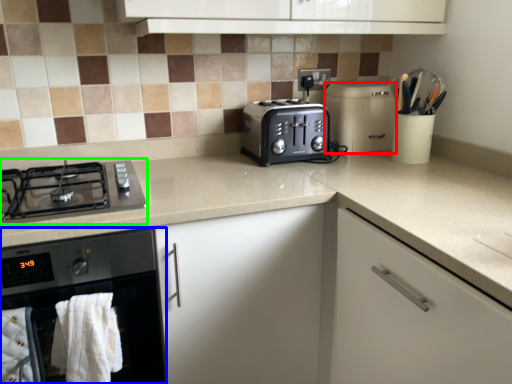
Question: Estimate the real-world distances between objects in this image. Which object is closer to kitchen appliance (highlighted by a red box), home appliance (highlighted by a blue box) or gas stove (highlighted by a green box)?

Choices:
 (A) home appliance
 (B) gas stove

Answer: (B)